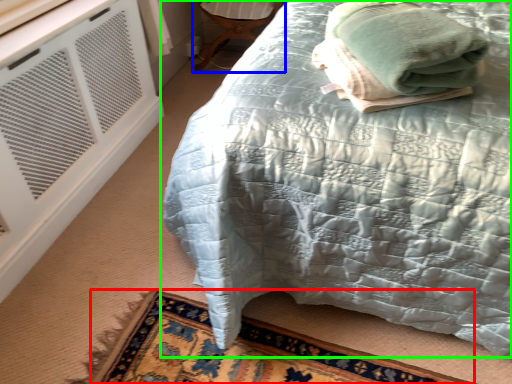
Question: Which object is the closest to the mat (highlighted by a red box)? Choose among these: furniture (highlighted by a blue box) or bed (highlighted by a green box).

Choices:
 (A) furniture
 (B) bed

Answer: (B)